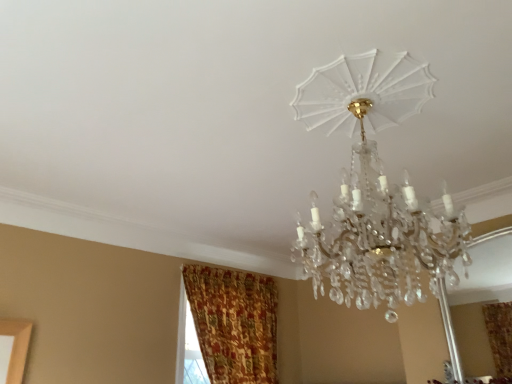
Question: Is textured gold curtain at lower left completely or partially inside clear crystal chandelier at upper center?

Choices:
 (A) no
 (B) yes

Answer: (A)

Question: Is clear crystal chandelier at upper center positioned with its back to textured gold curtain at lower left?

Choices:
 (A) yes
 (B) no

Answer: (B)

Question: From the image's perspective, is clear crystal chandelier at upper center beneath textured gold curtain at lower left?

Choices:
 (A) yes
 (B) no

Answer: (B)

Question: Does clear crystal chandelier at upper center appear on the left side of textured gold curtain at lower left?

Choices:
 (A) no
 (B) yes

Answer: (A)

Question: Is clear crystal chandelier at upper center taller than textured gold curtain at lower left?

Choices:
 (A) no
 (B) yes

Answer: (A)

Question: Is clear crystal chandelier at upper center thinner than textured gold curtain at lower left?

Choices:
 (A) yes
 (B) no

Answer: (B)

Question: Is there a large distance between textured gold curtain at lower left and clear crystal chandelier at upper center?

Choices:
 (A) no
 (B) yes

Answer: (B)

Question: Considering the relative sizes of textured gold curtain at lower left and clear crystal chandelier at upper center in the image provided, is textured gold curtain at lower left smaller than clear crystal chandelier at upper center?

Choices:
 (A) yes
 (B) no

Answer: (A)

Question: Does textured gold curtain at lower left have a greater height compared to clear crystal chandelier at upper center?

Choices:
 (A) yes
 (B) no

Answer: (A)

Question: Does textured gold curtain at lower left have a lesser width compared to clear crystal chandelier at upper center?

Choices:
 (A) yes
 (B) no

Answer: (A)

Question: Is textured gold curtain at lower left aimed at clear crystal chandelier at upper center?

Choices:
 (A) yes
 (B) no

Answer: (A)

Question: Does textured gold curtain at lower left appear on the right side of clear crystal chandelier at upper center?

Choices:
 (A) yes
 (B) no

Answer: (B)

Question: Is textured gold curtain at lower left in front of or behind clear crystal chandelier at upper center in the image?

Choices:
 (A) behind
 (B) front

Answer: (A)